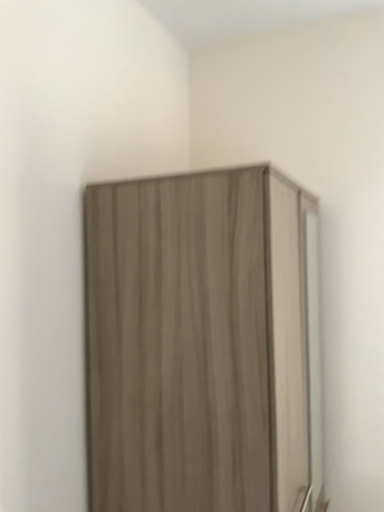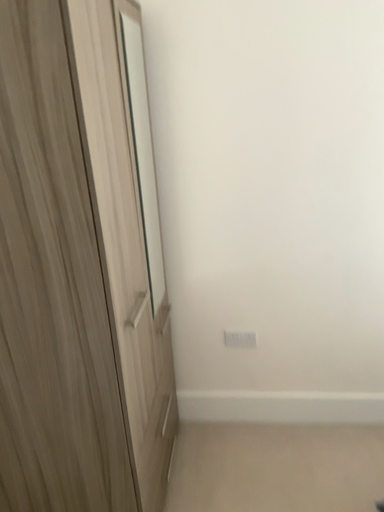
Question: Which way did the camera rotate in the video?

Choices:
 (A) rotated left
 (B) rotated right

Answer: (B)